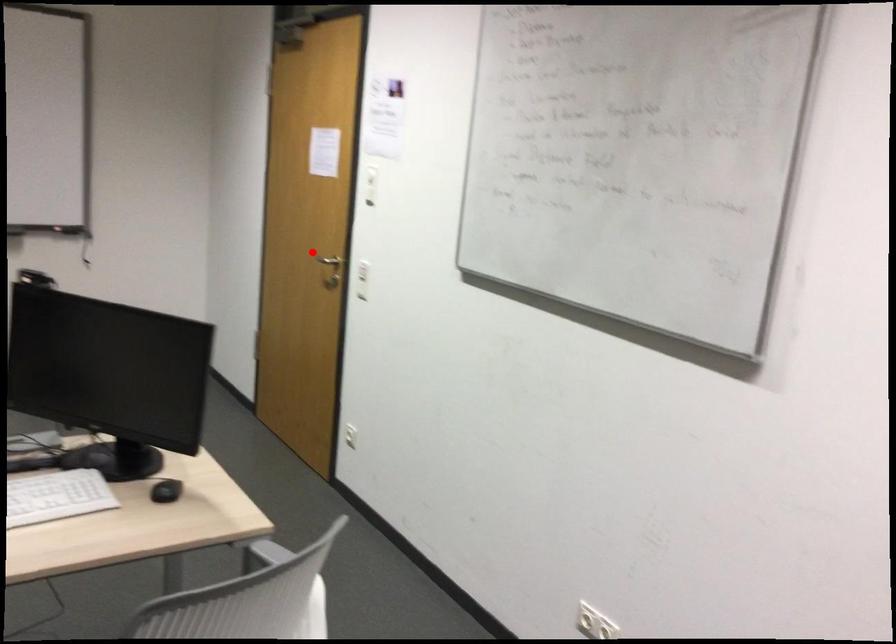
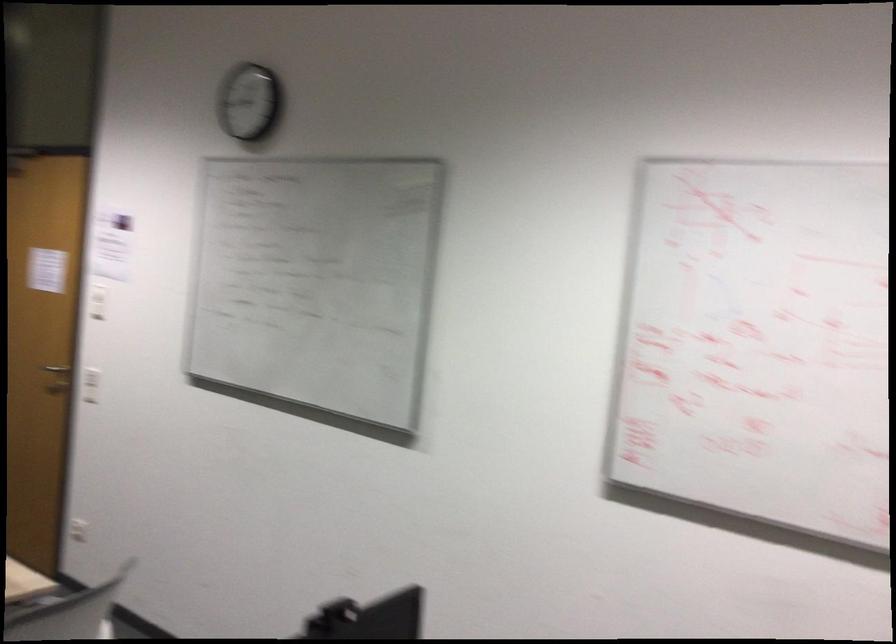
Find the pixel in the second image that matches the highlighted location in the first image.

(56, 368)